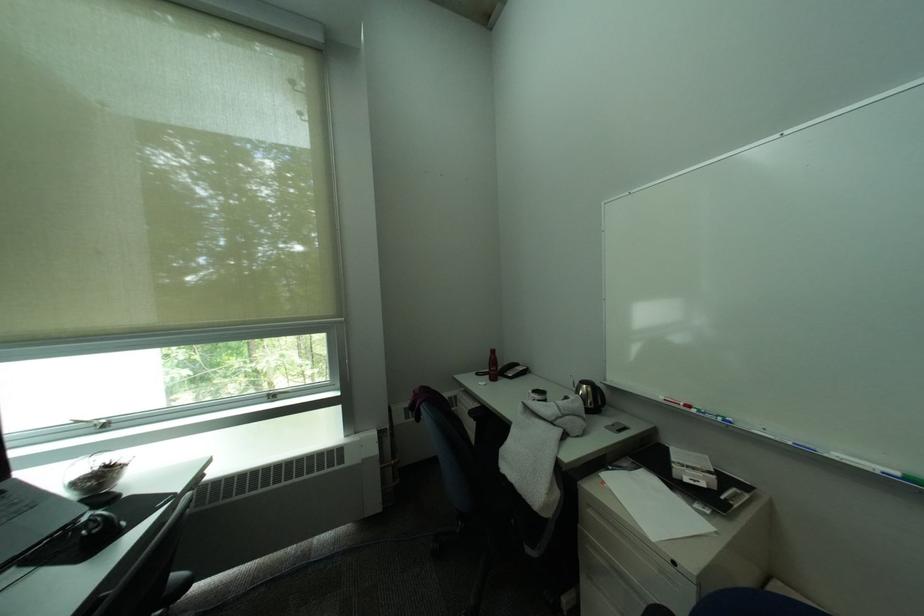
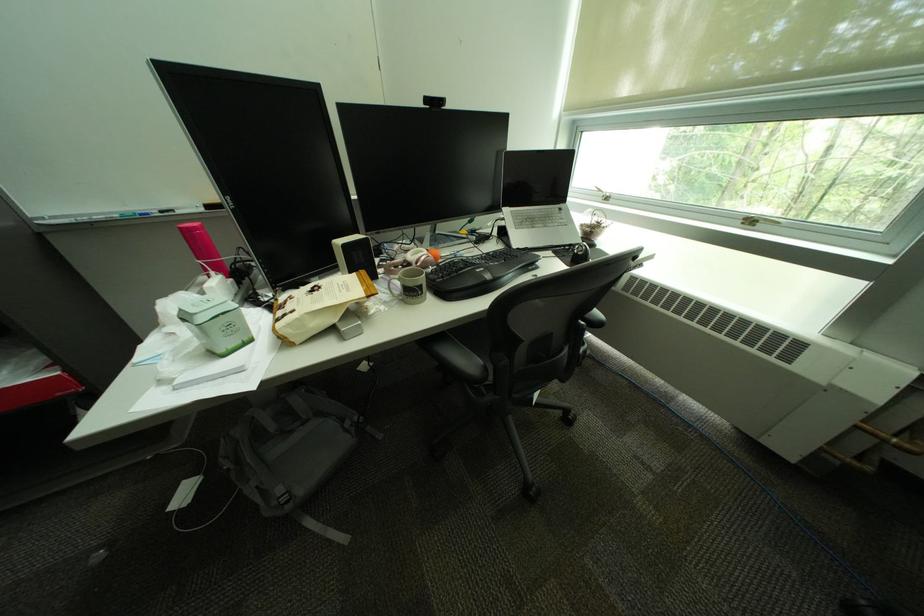
Find the pixel in the second image that matches point (75, 529) in the first image.

(580, 246)